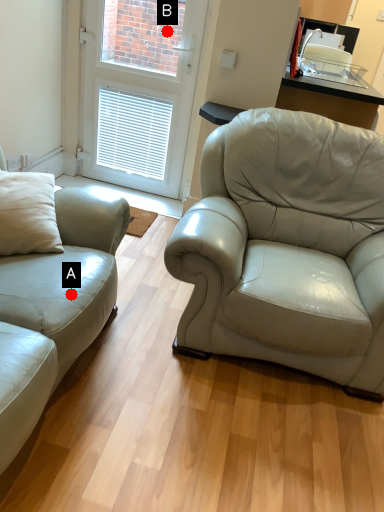
Question: Two points are circled on the image, labeled by A and B beside each circle. Which point is farther from the camera taking this photo?

Choices:
 (A) A is further
 (B) B is further

Answer: (B)